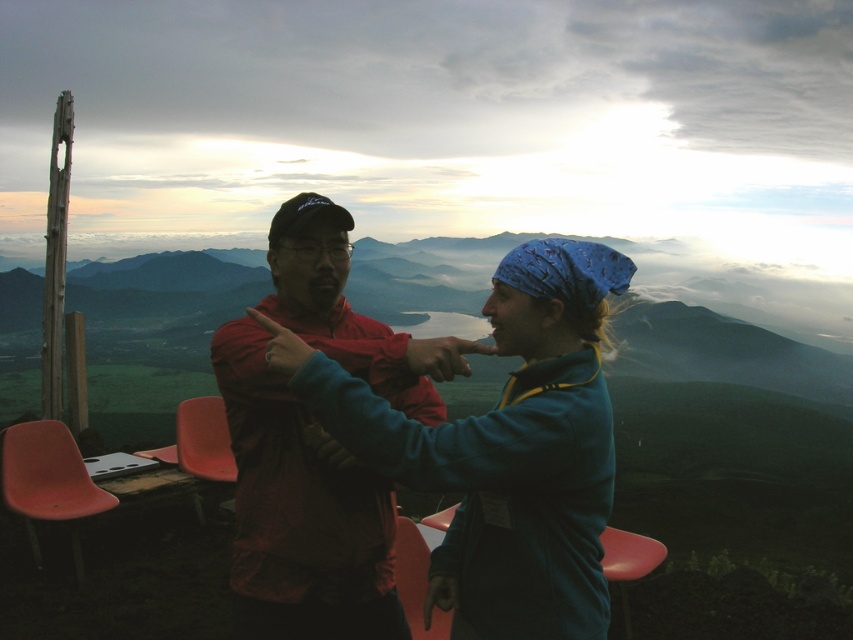
You are standing at the center of the image and want to sit down on the matte plastic chair at lower left. In which direction should you move to reach it?

The matte plastic chair at lower left is located at point (x=204, y=440), so you should move towards the lower left direction to reach it.

In the scene shown: You are planning to sit on the matte plastic chair at lower left while wearing the matte red jacket at center. Will the jacket fit comfortably on the chair without any part hanging off the edges?

The matte red jacket at center is wider than the matte plastic chair at lower left, so the jacket may hang off the edges when sitting on the chair.